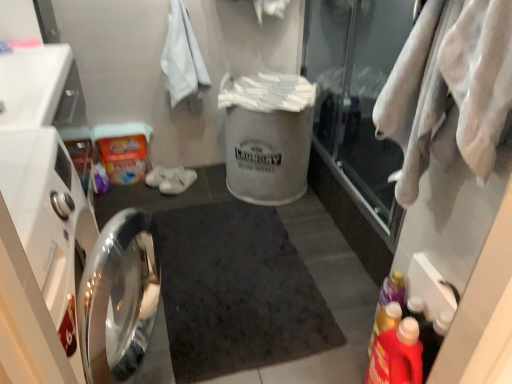
Where is `white fabric bag at center`? The image size is (512, 384). white fabric bag at center is located at coordinates pyautogui.click(x=267, y=136).

Locate an element on the screen. The image size is (512, 384). transparent glass door at upper right is located at coordinates (356, 97).

What is the approximate height of white cotton towel at right?

It is 17.65 inches.

Image resolution: width=512 pixels, height=384 pixels. What do you see at coordinates (236, 291) in the screenshot?
I see `dark matte bath mat at center` at bounding box center [236, 291].

What are the coordinates of `polished stainless steel dishwasher at left` in the screenshot? It's located at (61, 240).

What is the approximate width of polished stainless steel dishwasher at left?

24.25 inches.

This screenshot has height=384, width=512. What are the coordinates of `white cotton bath towel at upper left` in the screenshot? It's located at (182, 56).

Can you tell me how much translucent plastic detergent at lower right, placed as the 1th bottle when sorted from back to front, and dark matte bath mat at center differ in facing direction?

103 degrees.

Which object is positioned more to the right, translucent plastic detergent at lower right, placed as the 1th bottle when sorted from back to front, or dark matte bath mat at center?

From the viewer's perspective, translucent plastic detergent at lower right, placed as the 1th bottle when sorted from back to front, appears more on the right side.

Is translucent plastic detergent at lower right, placed as the 1th bottle when sorted from back to front, positioned far away from dark matte bath mat at center?

translucent plastic detergent at lower right, placed as the 1th bottle when sorted from back to front, is actually quite close to dark matte bath mat at center.

Is translucent plastic detergent at lower right, the 2th bottle when ordered from front to back, positioned with its back to dark matte bath mat at center?

No, translucent plastic detergent at lower right, the 2th bottle when ordered from front to back, is not facing the opposite direction of dark matte bath mat at center.

From a real-world perspective, is translucent plastic detergent at lower right, placed as the 1th bottle when sorted from back to front, positioned above or below polished stainless steel dishwasher at left?

translucent plastic detergent at lower right, placed as the 1th bottle when sorted from back to front, is below polished stainless steel dishwasher at left.

Is the position of translucent plastic detergent at lower right, the 2th bottle when ordered from front to back, more distant than that of polished stainless steel dishwasher at left?

That is True.

From the image's perspective, is translucent plastic detergent at lower right, the 2th bottle when ordered from front to back, positioned above or below polished stainless steel dishwasher at left?

translucent plastic detergent at lower right, the 2th bottle when ordered from front to back, is situated lower than polished stainless steel dishwasher at left in the image.

From the image's perspective, which object appears higher, transparent glass door at upper right or white fabric bag at center?

transparent glass door at upper right appears higher in the image.

Which is behind, transparent glass door at upper right or white fabric bag at center?

Positioned behind is white fabric bag at center.

Does transparent glass door at upper right appear on the left side of white fabric bag at center?

No.

Considering the points (325, 17) and (278, 103), which point is behind, point (325, 17) or point (278, 103)?

The point (325, 17) is more distant.

Could you tell me if white fabric bag at center is turned towards white cotton bath towel at upper left?

Answer: No, white fabric bag at center is not turned towards white cotton bath towel at upper left.

From their relative heights in the image, would you say white fabric bag at center is taller or shorter than white cotton bath towel at upper left?

Clearly, white fabric bag at center is taller compared to white cotton bath towel at upper left.

Considering the relative sizes of white fabric bag at center and white cotton bath towel at upper left in the image provided, is white fabric bag at center wider than white cotton bath towel at upper left?

Indeed, white fabric bag at center has a greater width compared to white cotton bath towel at upper left.

Does polished stainless steel dishwasher at left have a lesser height compared to white cotton towel at right?

No.

From a real-world perspective, is polished stainless steel dishwasher at left physically above white cotton towel at right?

Incorrect, from a real-world perspective, polished stainless steel dishwasher at left is lower than white cotton towel at right.

Is white cotton towel at right a part of polished stainless steel dishwasher at left?

No, white cotton towel at right is located outside of polished stainless steel dishwasher at left.

Is polished stainless steel dishwasher at left closer to camera compared to white cotton towel at right?

Yes, the depth of polished stainless steel dishwasher at left is less than that of white cotton towel at right.

Is white cotton bath towel at upper left oriented towards dark matte bath mat at center?

Yes, white cotton bath towel at upper left faces towards dark matte bath mat at center.

Consider the image. Can you tell me how much white cotton bath towel at upper left and dark matte bath mat at center differ in facing direction?

white cotton bath towel at upper left and dark matte bath mat at center are facing 2.81 degrees away from each other.

Who is taller, white cotton bath towel at upper left or dark matte bath mat at center?

Standing taller between the two is white cotton bath towel at upper left.

Consider the image. Is white cotton bath towel at upper left to the left or to the right of dark matte bath mat at center in the image?

Based on their positions, white cotton bath towel at upper left is located to the left of dark matte bath mat at center.

From a real-world perspective, between red plastic detergent at lower right, which appears as the first bottle when viewed from the front, and white cotton bath towel at upper left, who is vertically lower?

red plastic detergent at lower right, which appears as the first bottle when viewed from the front.

Consider the image. How many degrees apart are the facing directions of red plastic detergent at lower right, which appears as the first bottle when viewed from the front, and white cotton bath towel at upper left?

They differ by 91.7 degrees in their facing directions.

Who is smaller, red plastic detergent at lower right, which appears as the first bottle when viewed from the front, or white cotton bath towel at upper left?

red plastic detergent at lower right, which appears as the first bottle when viewed from the front, is smaller.

Can we say red plastic detergent at lower right, the second bottle in the back-to-front sequence, lies outside white cotton bath towel at upper left?

Indeed, red plastic detergent at lower right, the second bottle in the back-to-front sequence, is completely outside white cotton bath towel at upper left.

Where is `the 1st bottle in front of the dark matte bath mat at center`? Image resolution: width=512 pixels, height=384 pixels. the 1st bottle in front of the dark matte bath mat at center is located at coordinates (385, 321).

Starting from the polished stainless steel dishwasher at left, which bottle is the 2nd one to the right? Please provide its 2D coordinates.

[(385, 321)]

In the scene shown: Which object lies further to the anchor point white cotton towel at right, polished stainless steel dishwasher at left or red plastic detergent at lower right, which appears as the first bottle when viewed from the front?

The object further to white cotton towel at right is polished stainless steel dishwasher at left.

Based on their spatial positions, is transparent glass door at upper right or red plastic detergent at lower right, the second bottle in the back-to-front sequence, further from white cotton bath towel at upper left?

red plastic detergent at lower right, the second bottle in the back-to-front sequence, is further to white cotton bath towel at upper left.

Estimate the real-world distances between objects in this image. Which object is closer to white cotton towel at right, white fabric bag at center or translucent plastic detergent at lower right, placed as the 1th bottle when sorted from back to front?

translucent plastic detergent at lower right, placed as the 1th bottle when sorted from back to front, is positioned closer to the anchor white cotton towel at right.

Looking at the image, which one is located closer to polished stainless steel dishwasher at left, translucent plastic detergent at lower right, placed as the 1th bottle when sorted from back to front, or transparent glass door at upper right?

Among the two, translucent plastic detergent at lower right, placed as the 1th bottle when sorted from back to front, is located nearer to polished stainless steel dishwasher at left.

Looking at the image, which one is located closer to dark matte bath mat at center, white fabric bag at center or translucent plastic detergent at lower right, the 2th bottle when ordered from front to back?

Based on the image, white fabric bag at center appears to be nearer to dark matte bath mat at center.

Estimate the real-world distances between objects in this image. Which object is closer to white cotton bath towel at upper left, red plastic detergent at lower right, which appears as the first bottle when viewed from the front, or translucent plastic detergent at lower right, the 2th bottle when ordered from front to back?

translucent plastic detergent at lower right, the 2th bottle when ordered from front to back, lies closer to white cotton bath towel at upper left than the other object.

Looking at the image, which one is located further to transparent glass door at upper right, dark matte bath mat at center or translucent plastic detergent at lower right, the 2th bottle when ordered from front to back?

translucent plastic detergent at lower right, the 2th bottle when ordered from front to back, is positioned further to the anchor transparent glass door at upper right.

When comparing their distances from translucent plastic detergent at lower right, the 2th bottle when ordered from front to back, does white fabric bag at center or white cotton bath towel at upper left seem further?

Among the two, white cotton bath towel at upper left is located further to translucent plastic detergent at lower right, the 2th bottle when ordered from front to back.

Where is `bath mat that lies between white fabric bag at center and red plastic detergent at lower right, the second bottle in the back-to-front sequence, from top to bottom`? The image size is (512, 384). bath mat that lies between white fabric bag at center and red plastic detergent at lower right, the second bottle in the back-to-front sequence, from top to bottom is located at coordinates (236, 291).

You are a GUI agent. You are given a task and a screenshot of the screen. Output one action in this format:
    pyautogui.click(x=<x>, y=<y>)
    Task: Click on the bath towel between white cotton towel at right and white fabric bag at center from front to back
    
    Given the screenshot: What is the action you would take?
    click(x=182, y=56)

The width and height of the screenshot is (512, 384). Identify the location of bottle that lies between white fabric bag at center and red plastic detergent at lower right, the second bottle in the back-to-front sequence, from top to bottom. (385, 321).

The width and height of the screenshot is (512, 384). In order to click on clothing between polished stainless steel dishwasher at left and white cotton bath towel at upper left from front to back in this screenshot , I will do `click(450, 91)`.